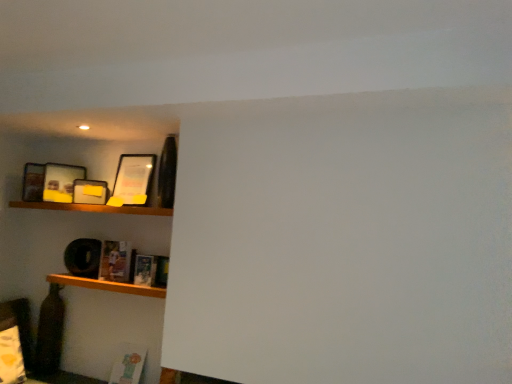
Question: Is hardcover book at lower left, the first book in the front-to-back sequence, not within matte yellow picture frame at upper left, arranged as the second picture frame when viewed from the left?

Choices:
 (A) yes
 (B) no

Answer: (A)

Question: Is hardcover book at lower left, the first book in the front-to-back sequence, to the right of matte yellow picture frame at upper left, the second picture frame when ordered from right to left, from the viewer's perspective?

Choices:
 (A) no
 (B) yes

Answer: (B)

Question: Would you say hardcover book at lower left, the second book from the left, is a long distance from matte yellow picture frame at upper left, the second picture frame when ordered from right to left?

Choices:
 (A) yes
 (B) no

Answer: (B)

Question: Is hardcover book at lower left, the first book from the right, closer to the viewer compared to matte yellow picture frame at upper left, the second picture frame when ordered from right to left?

Choices:
 (A) yes
 (B) no

Answer: (A)

Question: From the image's perspective, is hardcover book at lower left, which is the second book in back-to-front order, located beneath matte yellow picture frame at upper left, arranged as the second picture frame when viewed from the left?

Choices:
 (A) no
 (B) yes

Answer: (B)

Question: Considering the relative sizes of hardcover book at lower left, the first book from the right, and matte yellow picture frame at upper left, the second picture frame when ordered from right to left, in the image provided, is hardcover book at lower left, the first book from the right, wider than matte yellow picture frame at upper left, the second picture frame when ordered from right to left,?

Choices:
 (A) no
 (B) yes

Answer: (B)

Question: Can matte black picture frame at upper left, arranged as the first picture frame when viewed from the left, be found inside matte paper book at lower left, placed as the 2th book when sorted from right to left?

Choices:
 (A) no
 (B) yes

Answer: (A)

Question: From the image's perspective, is matte paper book at lower left, which appears as the 1th book when viewed from the left, below matte black picture frame at upper left, arranged as the first picture frame when viewed from the left?

Choices:
 (A) yes
 (B) no

Answer: (A)

Question: Is the position of matte paper book at lower left, which appears as the 1th book when viewed from the left, more distant than that of matte black picture frame at upper left, the third picture frame in the right-to-left sequence?

Choices:
 (A) yes
 (B) no

Answer: (B)

Question: Considering the relative sizes of matte paper book at lower left, placed as the 2th book when sorted from right to left, and matte black picture frame at upper left, the third picture frame in the right-to-left sequence, in the image provided, is matte paper book at lower left, placed as the 2th book when sorted from right to left, bigger than matte black picture frame at upper left, the third picture frame in the right-to-left sequence,?

Choices:
 (A) no
 (B) yes

Answer: (B)

Question: Is matte paper book at lower left, which appears as the 1th book when viewed from the left, wider than matte black picture frame at upper left, the third picture frame in the right-to-left sequence?

Choices:
 (A) no
 (B) yes

Answer: (B)

Question: Considering the relative sizes of matte paper book at lower left, the second book in the front-to-back sequence, and matte black picture frame at upper left, the third picture frame in the right-to-left sequence, in the image provided, is matte paper book at lower left, the second book in the front-to-back sequence, taller than matte black picture frame at upper left, the third picture frame in the right-to-left sequence,?

Choices:
 (A) no
 (B) yes

Answer: (A)

Question: Does hardcover book at lower left, which is the second book in back-to-front order, have a greater width compared to matte black picture frame at upper left, arranged as the first picture frame when viewed from the left?

Choices:
 (A) no
 (B) yes

Answer: (A)